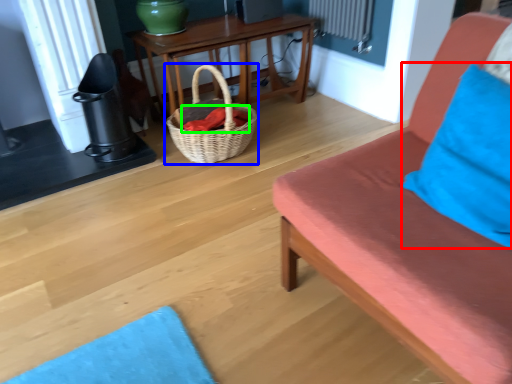
Question: Which object is the closest to the pillow (highlighted by a red box)? Choose among these: picnic basket (highlighted by a blue box) or material (highlighted by a green box).

Choices:
 (A) picnic basket
 (B) material

Answer: (A)